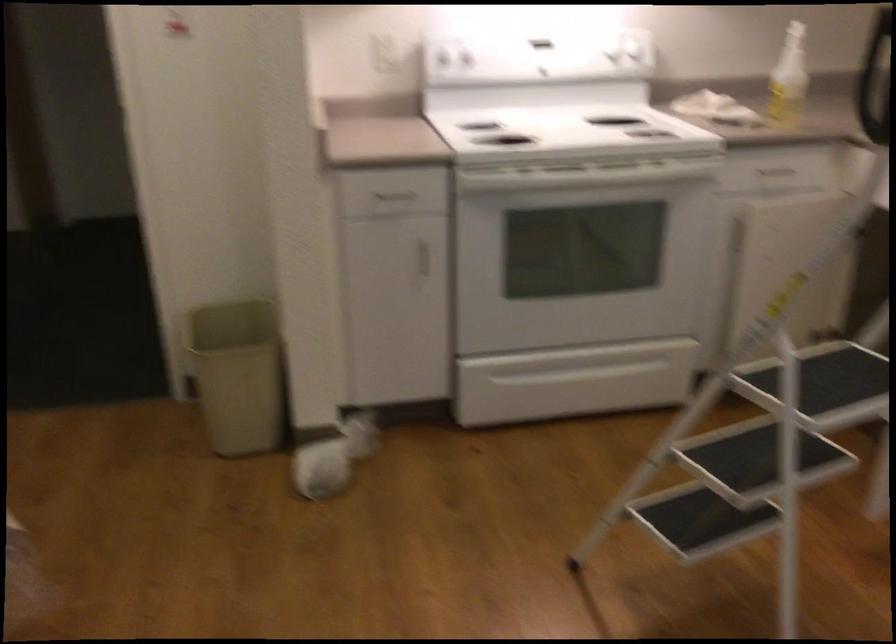
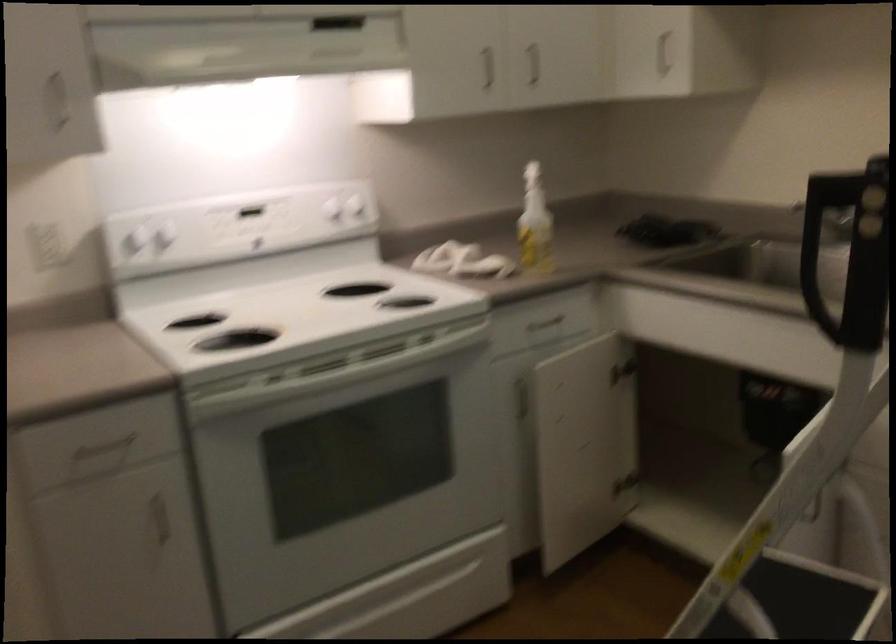
In the second image, find the point that corresponds to (x=789, y=75) in the first image.

(535, 223)